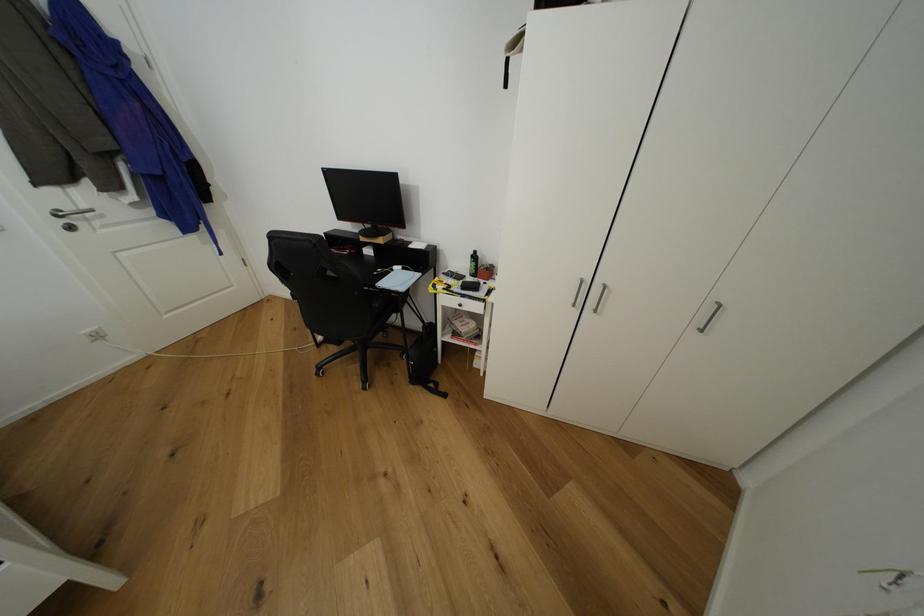
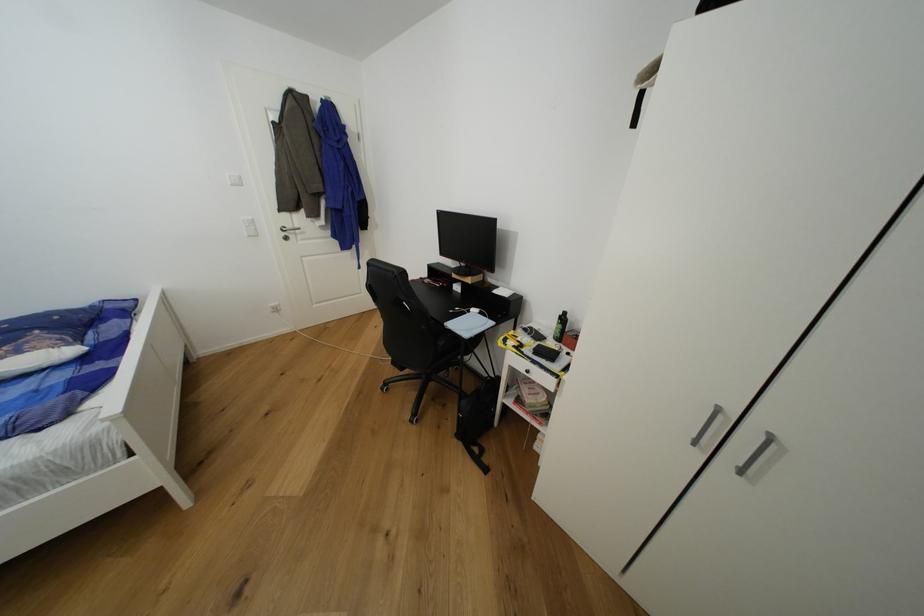
Question: The camera is either moving clockwise (left) or counter-clockwise (right) around the object. The first image is from the beginning of the video and the second image is from the end. Is the camera moving left or right when shooting the video?

Choices:
 (A) Left
 (B) Right

Answer: (B)